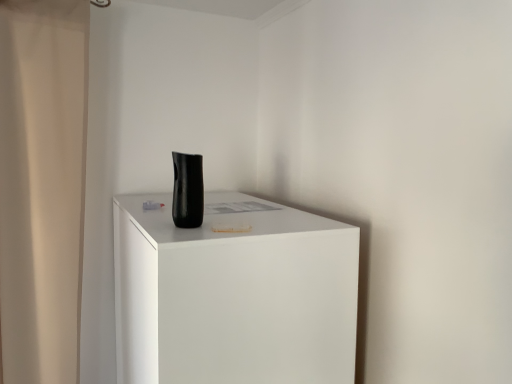
Question: From a real-world perspective, is black matte vase at center under beige fabric shower curtain at left?

Choices:
 (A) no
 (B) yes

Answer: (A)

Question: Is black matte vase at center shorter than beige fabric shower curtain at left?

Choices:
 (A) no
 (B) yes

Answer: (B)

Question: Does black matte vase at center lie in front of beige fabric shower curtain at left?

Choices:
 (A) yes
 (B) no

Answer: (A)

Question: Is black matte vase at center turned away from beige fabric shower curtain at left?

Choices:
 (A) no
 (B) yes

Answer: (A)

Question: Can we say black matte vase at center lies outside beige fabric shower curtain at left?

Choices:
 (A) no
 (B) yes

Answer: (B)

Question: In the image, is black matte vase at center on the left side or the right side of beige fabric shower curtain at left?

Choices:
 (A) right
 (B) left

Answer: (A)

Question: In the image, is black matte vase at center positioned in front of or behind beige fabric shower curtain at left?

Choices:
 (A) behind
 (B) front

Answer: (B)

Question: From the image's perspective, is black matte vase at center located above or below beige fabric shower curtain at left?

Choices:
 (A) above
 (B) below

Answer: (A)

Question: Which is correct: black matte vase at center is inside beige fabric shower curtain at left, or outside of it?

Choices:
 (A) outside
 (B) inside

Answer: (A)

Question: Is matte black vase at center taller or shorter than beige fabric shower curtain at left?

Choices:
 (A) short
 (B) tall

Answer: (A)

Question: Relative to beige fabric shower curtain at left, is matte black vase at center in front or behind?

Choices:
 (A) front
 (B) behind

Answer: (A)

Question: From a real-world perspective, is matte black vase at center positioned above or below beige fabric shower curtain at left?

Choices:
 (A) above
 (B) below

Answer: (B)

Question: Does point (327, 249) appear closer or farther from the camera than point (10, 13)?

Choices:
 (A) closer
 (B) farther

Answer: (A)

Question: Is beige fabric shower curtain at left wider or thinner than black matte vase at center?

Choices:
 (A) wide
 (B) thin

Answer: (A)

Question: From a real-world perspective, relative to black matte vase at center, is beige fabric shower curtain at left vertically above or below?

Choices:
 (A) below
 (B) above

Answer: (A)